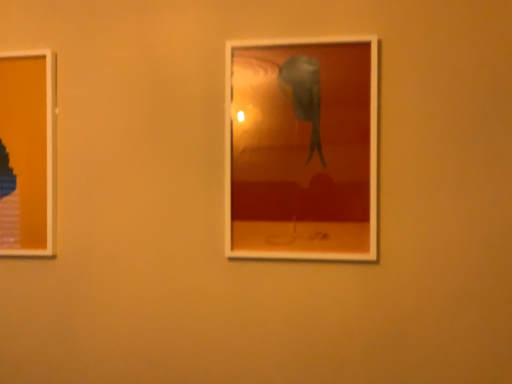
Question: Would you say matte plastic picture frame at center, which is the second picture frame in back-to-front order, is inside or outside matte plastic picture frame at left, the second picture frame positioned from the right?

Choices:
 (A) inside
 (B) outside

Answer: (B)

Question: Is matte plastic picture frame at center, which is the second picture frame in back-to-front order, taller or shorter than matte plastic picture frame at left, the second picture frame positioned from the right?

Choices:
 (A) tall
 (B) short

Answer: (A)

Question: In the image, is matte plastic picture frame at center, marked as the 1th picture frame in a front-to-back arrangement, positioned in front of or behind matte plastic picture frame at left, the second picture frame positioned from the right?

Choices:
 (A) front
 (B) behind

Answer: (A)

Question: Relative to matte plastic picture frame at center, marked as the 1th picture frame in a front-to-back arrangement, is matte plastic picture frame at left, the first picture frame positioned from the left, in front or behind?

Choices:
 (A) behind
 (B) front

Answer: (A)

Question: Choose the correct answer: Is matte plastic picture frame at left, the second picture frame positioned from the right, inside matte plastic picture frame at center, which is the first picture frame in right-to-left order, or outside it?

Choices:
 (A) outside
 (B) inside

Answer: (A)

Question: Would you say matte plastic picture frame at left, positioned as the second picture frame in front-to-back order, is to the left or to the right of matte plastic picture frame at center, which is the first picture frame in right-to-left order, in the picture?

Choices:
 (A) right
 (B) left

Answer: (B)

Question: From the image's perspective, is matte plastic picture frame at left, positioned as the second picture frame in front-to-back order, located above or below matte plastic picture frame at center, which is the first picture frame in right-to-left order?

Choices:
 (A) above
 (B) below

Answer: (B)